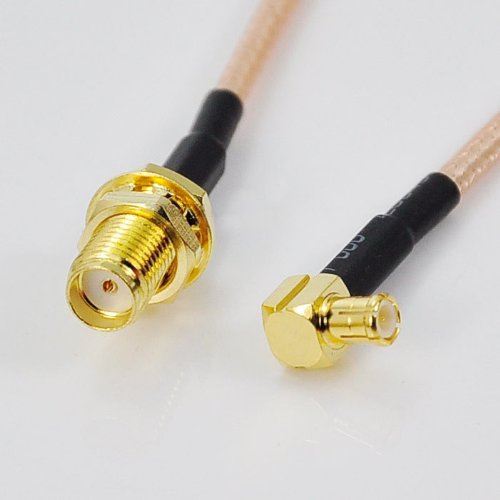
Find the location of a particular element. The width and height of the screenshot is (500, 500). table is located at coordinates (173, 395).